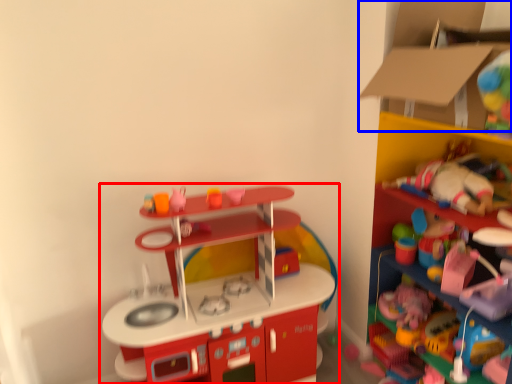
Question: Which of the following is the farthest to the observer, toy (highlighted by a red box) or cardboard box (highlighted by a blue box)?

Choices:
 (A) toy
 (B) cardboard box

Answer: (A)